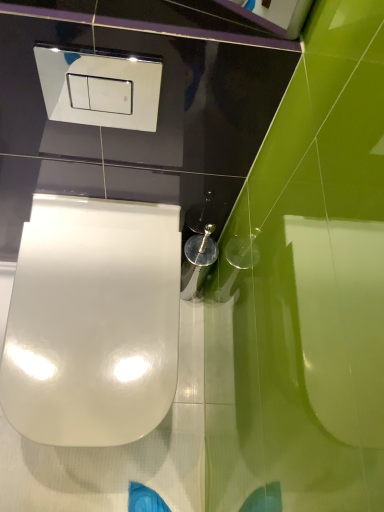
Find the location of a particular element. This screenshot has height=512, width=384. white glossy toilet seat at left is located at coordinates (93, 322).

What do you see at coordinates (93, 322) in the screenshot? This screenshot has height=512, width=384. I see `white glossy toilet seat at left` at bounding box center [93, 322].

Locate an element on the screen. The image size is (384, 512). white glossy toilet seat at left is located at coordinates (93, 322).